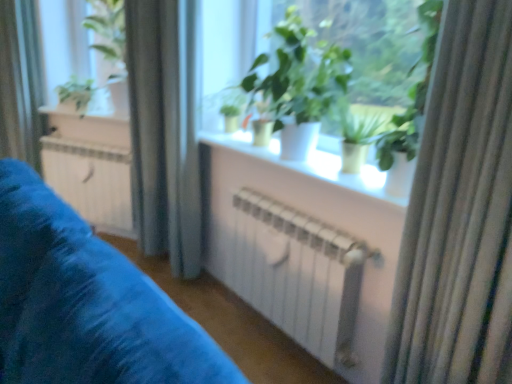
Question: In terms of height, does white matte radiator at center look taller or shorter compared to silky beige curtain at right, which is counted as the first curtain, starting from the right?

Choices:
 (A) short
 (B) tall

Answer: (A)

Question: Is white matte radiator at center bigger or smaller than silky beige curtain at right, placed as the third curtain when sorted from back to front?

Choices:
 (A) big
 (B) small

Answer: (A)

Question: Which is farther from the green matte plant at upper left, arranged as the first houseplant when viewed from the left?

Choices:
 (A) green matte plant at center, which is the 2th houseplant from front to back
 (B) silky beige curtain at right, arranged as the 3th curtain when viewed from the left
 (C) green matte plant at center, which appears as the second houseplant when viewed from the left
 (D) white glossy window sill at upper center, acting as the second window sill starting from the bottom
 (E) blue fabric curtain at left, which is counted as the 3th curtain, starting from the front

Answer: (B)

Question: Considering the real-world distances, which object is farthest from the white glossy window sill at upper center, acting as the 1th window sill starting from the left?

Choices:
 (A) blue fabric curtain at left, acting as the third curtain starting from the right
 (B) white metallic radiator at center
 (C) white matte radiator at center
 (D) satin fabric curtain at left, which is the 2th curtain from right to left
 (E) silky beige curtain at right, placed as the third curtain when sorted from back to front

Answer: (E)